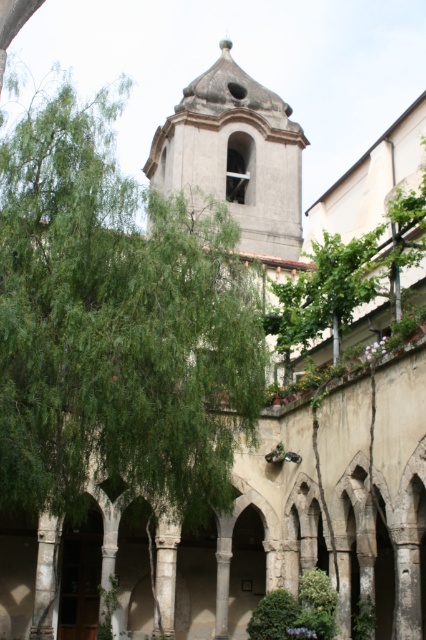
You are a visitor in the courtyard and want to take a photo of the gray stone bell tower at center from the green leafy tree at center. If your camera has a maximum focus range of 50 meters, will you be able to capture the tower clearly?

The distance between the green leafy tree at center and the gray stone bell tower at center is 55.10 meters. Since the camera can only focus up to 50 meters, you won not be able to capture the tower clearly.

You are standing in the courtyard and want to take a photo of the gray stone bell tower at center without any obstructions. Is the green leafy tree at center blocking your view of the bell tower?

The green leafy tree at center is located below the gray stone bell tower at center, so it might block the lower part of the tower but not the top where the bell is located. You can still see the upper portion of the gray stone bell tower at center above the tree.

You are an architect visiting this historical courtyard. You notice the green leafy tree at center and the gray stone bell tower at center. Which structure is taller?

The gray stone bell tower at center is taller than the green leafy tree at center.